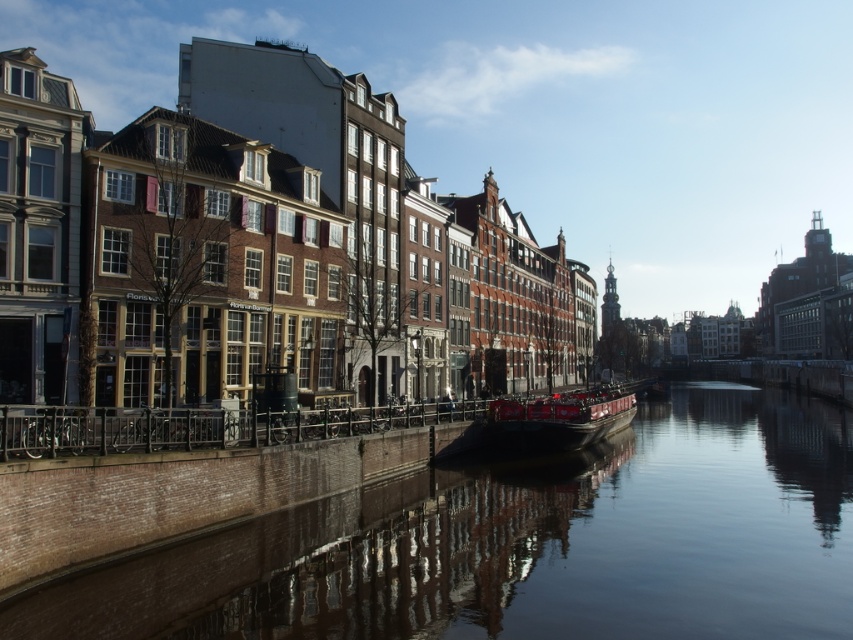
Can you confirm if smooth concrete canal at center is positioned to the right of red wooden boat at center?

Indeed, smooth concrete canal at center is positioned on the right side of red wooden boat at center.

Is smooth concrete canal at center in front of red wooden boat at center?

Yes, smooth concrete canal at center is closer to the viewer.

This screenshot has width=853, height=640. I want to click on smooth concrete canal at center, so click(x=526, y=545).